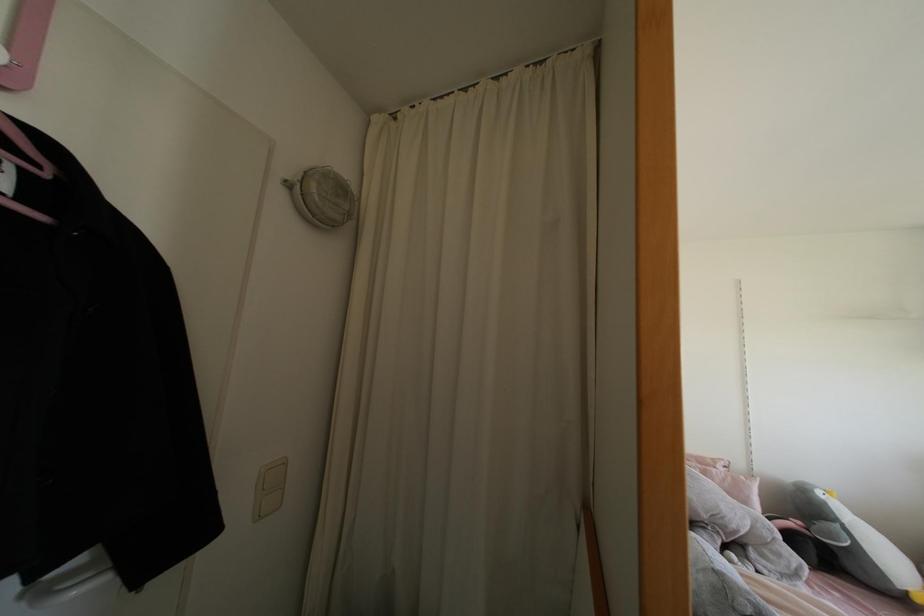
The image size is (924, 616). Describe the element at coordinates (270, 488) in the screenshot. I see `the white light switch` at that location.